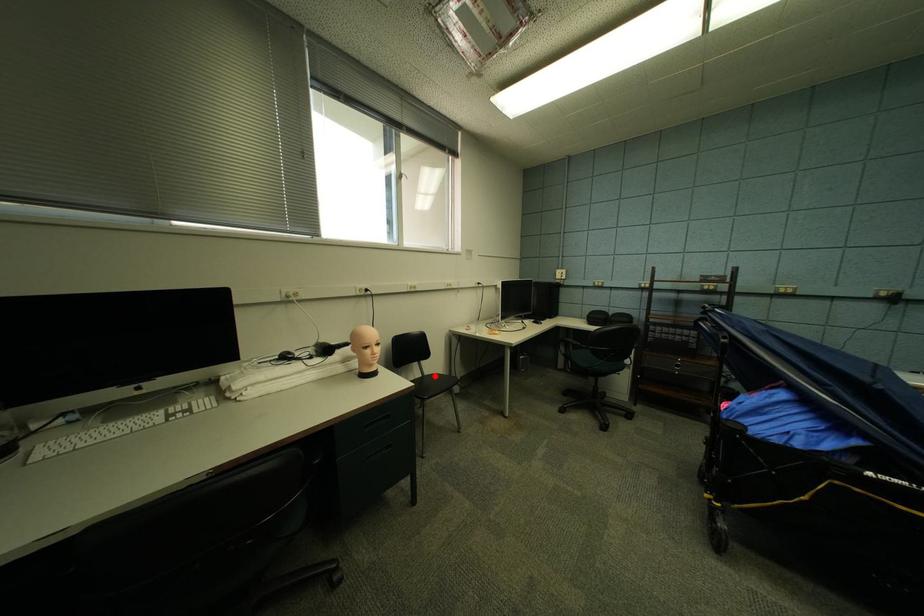
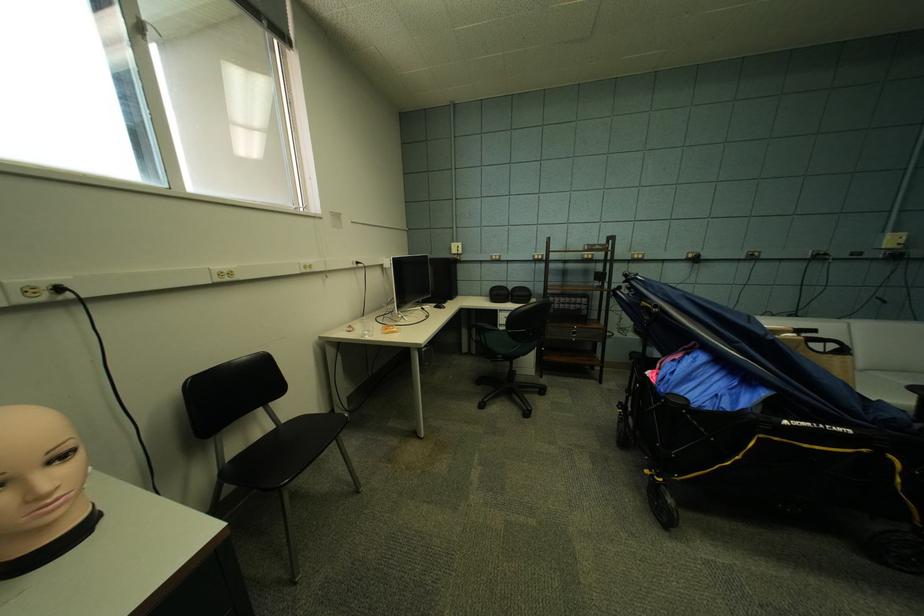
Question: A red point is marked in image1. In image2, is the corresponding 3D point closer to the camera or farther? Reply with the corresponding letter.

Choices:
 (A) The corresponding 3D point is closer.
 (B) The corresponding 3D point is farther.

Answer: (A)